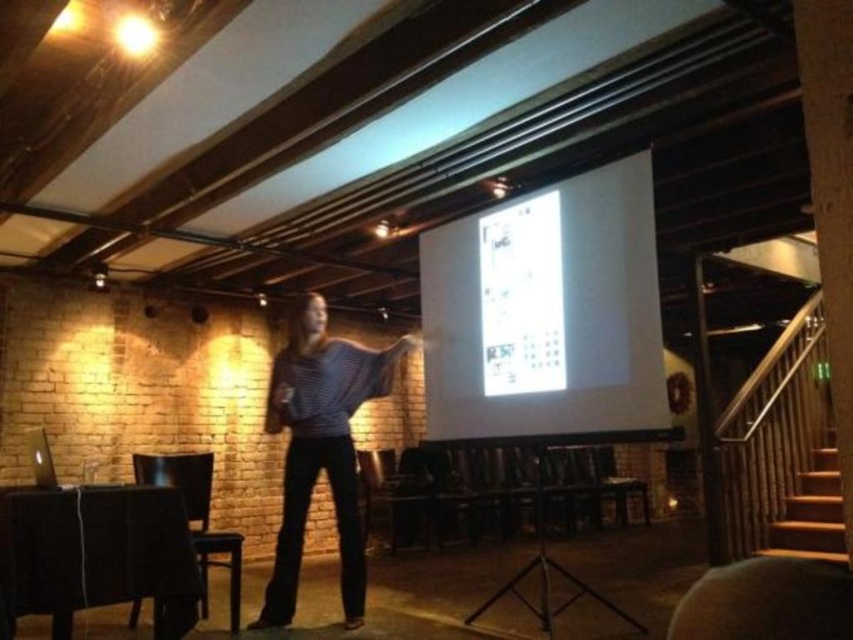
You are an attendee at the presentation and want to take a photo of the presenter. Since the white glossy projection screen at upper center is reflecting light, will the striped sweater at center be visible in your photo?

The white glossy projection screen at upper center is bigger than the striped sweater at center, but the question of visibility due to reflection isn

You are sitting in the audience and see the point at coordinates [547,312] on the wall. What object is located at that point?

The point at coordinates [547,312] corresponds to the white glossy projection screen at upper center.

You are an attendee sitting in the front row of the presentation. You notice the white glossy projection screen at upper center and the striped sweater at center. How far apart are these two items from your perspective?

The white glossy projection screen at upper center is 32.55 inches away from the striped sweater at center.